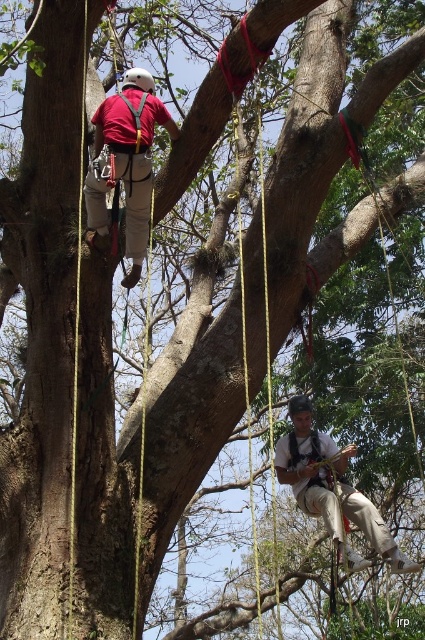
Which is below, matte red shirt at upper left or matte khaki pants at lower right?

matte khaki pants at lower right

Is point (138, 172) behind point (280, 438)?

No, (138, 172) is in front of (280, 438).

Find the location of a particular element. This screenshot has height=640, width=425. matte red shirt at upper left is located at coordinates point(127,161).